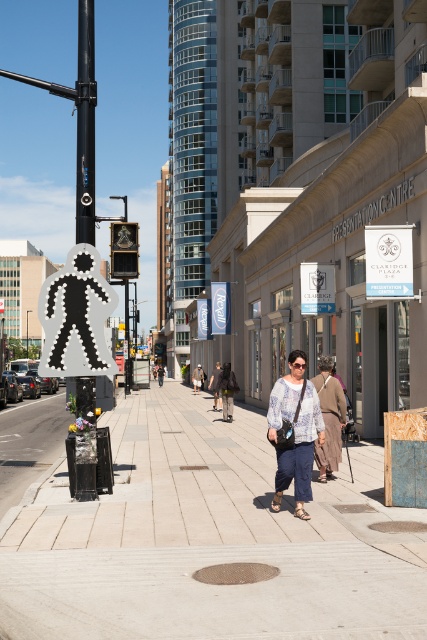
You are a delivery person who needs to place a box on the gray concrete sidewalk at center. However, there is a light brown leather jacket at center in the way. Can you move the jacket to make space for the box?

The gray concrete sidewalk at center is shorter than the light brown leather jacket at center, so the jacket might be too long to fit on the sidewalk if moved. Consider placing the box elsewhere.